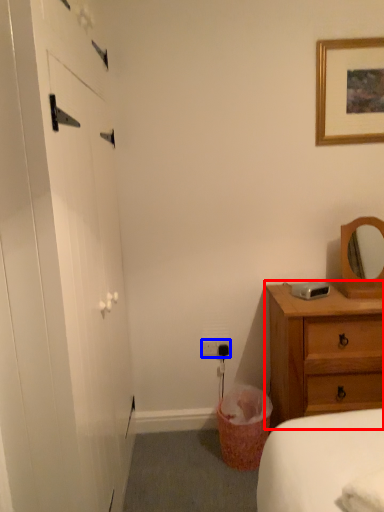
Question: Which object is closer to the camera taking this photo, chest of drawers (highlighted by a red box) or electric outlet (highlighted by a blue box)?

Choices:
 (A) chest of drawers
 (B) electric outlet

Answer: (A)